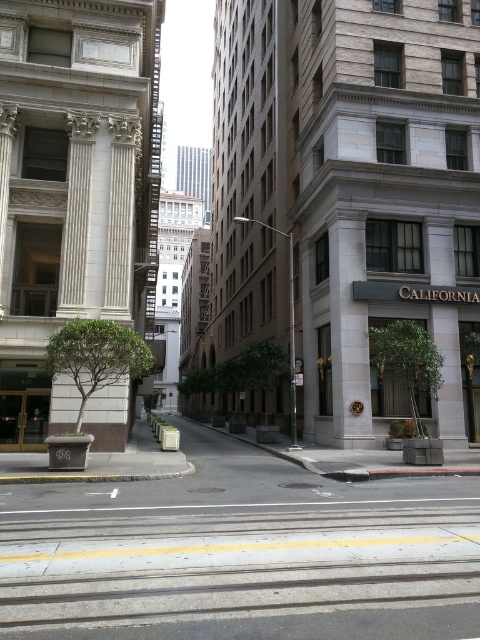
The width and height of the screenshot is (480, 640). I want to click on white marble pillar at left, so click(120, 218).

Is white marble pillar at left bigger than metallic street sign at center?

Incorrect, white marble pillar at left is not larger than metallic street sign at center.

Where is `white marble pillar at left`? This screenshot has width=480, height=640. white marble pillar at left is located at coordinates (120, 218).

The height and width of the screenshot is (640, 480). In order to click on white marble pillar at left in this screenshot , I will do `click(120, 218)`.